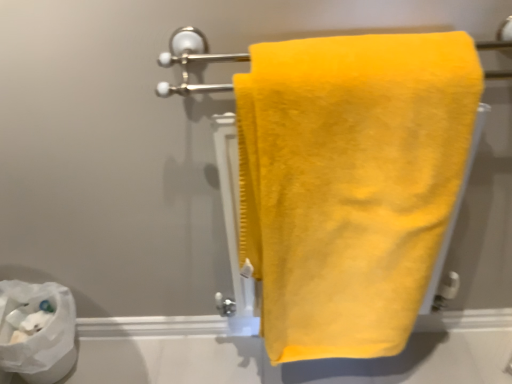
This screenshot has width=512, height=384. What are the coordinates of `white paper at lower left` in the screenshot? It's located at (39, 332).

Where is `white paper at lower left`? white paper at lower left is located at coordinates (39, 332).

Based on the photo, from their relative heights in the image, would you say white paper at lower left is taller or shorter than satin yellow towel at center?

Clearly, white paper at lower left is taller compared to satin yellow towel at center.

Is white paper at lower left inside or outside of satin yellow towel at center?

white paper at lower left cannot be found inside satin yellow towel at center.

Is white paper at lower left oriented towards satin yellow towel at center?

No, white paper at lower left does not turn towards satin yellow towel at center.

Locate an element on the screen. This screenshot has width=512, height=384. toilet paper behind the satin yellow towel at center is located at coordinates (39, 332).

Considering the positions of points (182, 64) and (364, 109), is point (182, 64) farther from camera compared to point (364, 109)?

Yes, it is.

Is satin yellow towel at center spatially inside yellow fluffy towel at center, or outside of it?

satin yellow towel at center is contained in yellow fluffy towel at center.

Between satin yellow towel at center and yellow fluffy towel at center, which one has smaller size?

Smaller between the two is satin yellow towel at center.

The width and height of the screenshot is (512, 384). What are the coordinates of `towel bar on the left of yellow fluffy towel at center` in the screenshot? It's located at (192, 62).

You are a GUI agent. You are given a task and a screenshot of the screen. Output one action in this format:
    pyautogui.click(x=<x>, y=<y>)
    Task: Click on the toilet paper behind the satin yellow towel at center
    This screenshot has height=384, width=512.
    Given the screenshot: What is the action you would take?
    pyautogui.click(x=39, y=332)

From the image's perspective, which one is positioned higher, satin yellow towel at center or white paper at lower left?

satin yellow towel at center.

In the scene shown: Is yellow fluffy towel at center facing towards satin yellow towel at center?

No, yellow fluffy towel at center is not aimed at satin yellow towel at center.

From the image's perspective, does yellow fluffy towel at center appear lower than satin yellow towel at center?

Indeed, from the image's perspective, yellow fluffy towel at center is shown beneath satin yellow towel at center.

Does yellow fluffy towel at center have a greater width compared to satin yellow towel at center?

Yes, yellow fluffy towel at center is wider than satin yellow towel at center.

From a real-world perspective, is yellow fluffy towel at center below satin yellow towel at center?

Correct, in the physical world, yellow fluffy towel at center is lower than satin yellow towel at center.

Can we say yellow fluffy towel at center lies outside white paper at lower left?

yellow fluffy towel at center lies outside white paper at lower left's area.

From a real-world perspective, does yellow fluffy towel at center sit lower than white paper at lower left?

Actually, yellow fluffy towel at center is physically above white paper at lower left in the real world.

Is yellow fluffy towel at center further to the viewer compared to white paper at lower left?

No, yellow fluffy towel at center is closer to the camera.

Which is nearer, (473,75) or (2,354)?

The point (473,75) is more forward.

Which object is closer to the camera, white paper at lower left or yellow fluffy towel at center?

yellow fluffy towel at center.

Is yellow fluffy towel at center a part of white paper at lower left?

No.

Is the surface of white paper at lower left in direct contact with yellow fluffy towel at center?

No, white paper at lower left is not with yellow fluffy towel at center.

Locate an element on the screen. Image resolution: width=512 pixels, height=384 pixels. toilet paper located on the left of satin yellow towel at center is located at coordinates (39, 332).

Locate an element on the screen. towel bar above the yellow fluffy towel at center (from a real-world perspective) is located at coordinates (192, 62).

When comparing their distances from yellow fluffy towel at center, does satin yellow towel at center or white paper at lower left seem further?

white paper at lower left lies further to yellow fluffy towel at center than the other object.

When comparing their distances from satin yellow towel at center, does white paper at lower left or yellow fluffy towel at center seem closer?

yellow fluffy towel at center is positioned closer to the anchor satin yellow towel at center.

Which object lies nearer to the anchor point yellow fluffy towel at center, white paper at lower left or satin yellow towel at center?

satin yellow towel at center lies closer to yellow fluffy towel at center than the other object.

Which object lies further to the anchor point white paper at lower left, yellow fluffy towel at center or satin yellow towel at center?

yellow fluffy towel at center lies further to white paper at lower left than the other object.

Based on their spatial positions, is satin yellow towel at center or yellow fluffy towel at center further from white paper at lower left?

Based on the image, yellow fluffy towel at center appears to be further to white paper at lower left.

Considering their positions, is yellow fluffy towel at center positioned closer to satin yellow towel at center than white paper at lower left?

yellow fluffy towel at center.

Image resolution: width=512 pixels, height=384 pixels. What are the coordinates of `towel bar situated between white paper at lower left and yellow fluffy towel at center from left to right` in the screenshot? It's located at (192, 62).